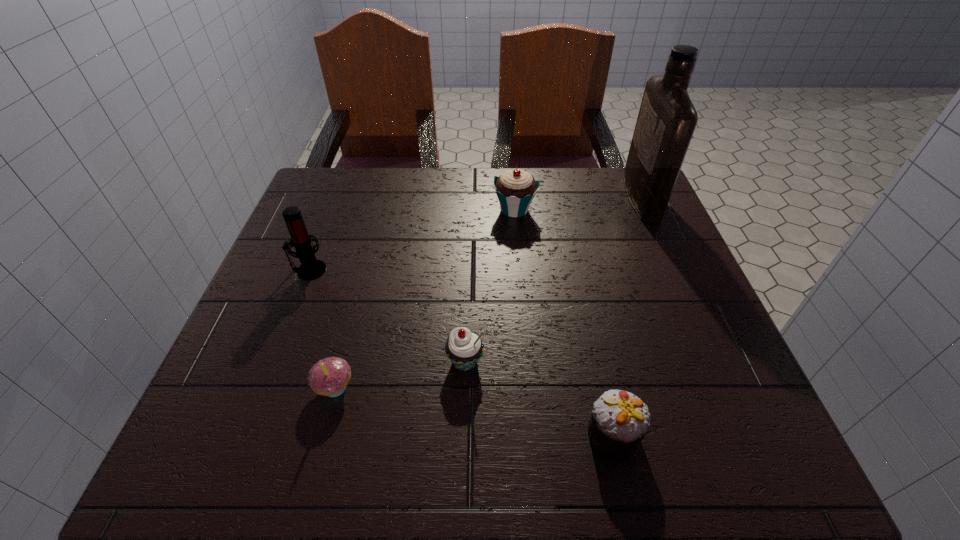
Where is `free space at the far right corner of the desktop`? The image size is (960, 540). free space at the far right corner of the desktop is located at coordinates (608, 180).

At what (x,y) coordinates should I click in order to perform the action: click on free space between the third cupcake from right to left and the fifth shortest object. Please return your answer as a coordinate pair (x, y). This screenshot has width=960, height=540. Looking at the image, I should click on (387, 316).

The width and height of the screenshot is (960, 540). I want to click on free space between the second cupcake from left to right and the liquor, so click(553, 280).

At what (x,y) coordinates should I click in order to perform the action: click on empty space between the liquor and the third cupcake from right to left. Please return your answer as a coordinate pair (x, y). Looking at the image, I should click on (553, 280).

Locate an element on the screen. Image resolution: width=960 pixels, height=540 pixels. vacant space that is in between the liquor and the rightmost cupcake is located at coordinates (627, 315).

What are the coordinates of `empty space between the tallest object and the microphone` in the screenshot? It's located at (475, 234).

Locate an element on the screen. The image size is (960, 540). blank region between the rightmost object and the third tallest object is located at coordinates (578, 204).

The height and width of the screenshot is (540, 960). Find the location of `vacant point located between the fifth object from right to left and the tallest cupcake`. vacant point located between the fifth object from right to left and the tallest cupcake is located at coordinates (424, 299).

You are a GUI agent. You are given a task and a screenshot of the screen. Output one action in this format:
    pyautogui.click(x=<x>, y=<y>)
    Task: Click on the free point between the second tallest object and the leftmost cupcake
    
    Given the screenshot: What is the action you would take?
    pyautogui.click(x=322, y=328)

At what (x,y) coordinates should I click in order to perform the action: click on vacant space in between the rightmost object and the third object from left to right. Please return your answer as a coordinate pair (x, y). The image size is (960, 540). Looking at the image, I should click on (553, 280).